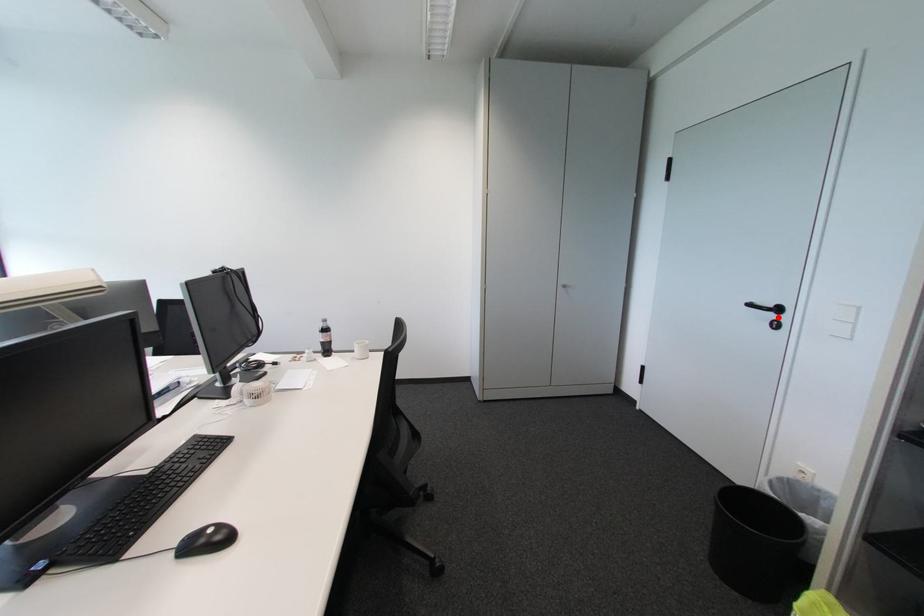
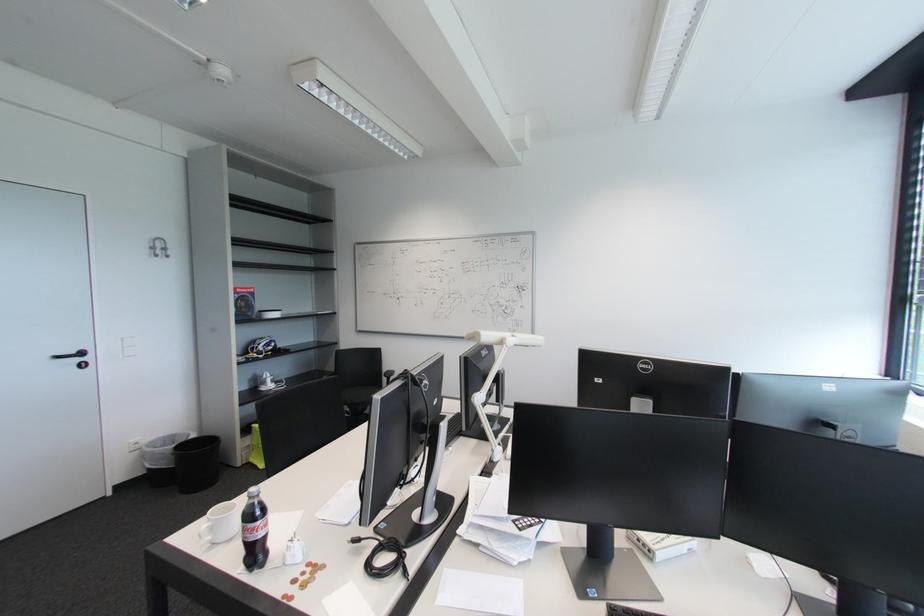
Question: I am providing you with two images of the same scene from different viewpoints. A red point is marked on the first image. At the location where the point appears in image 1, is it still visible in image 2?

Choices:
 (A) Yes
 (B) No

Answer: (A)